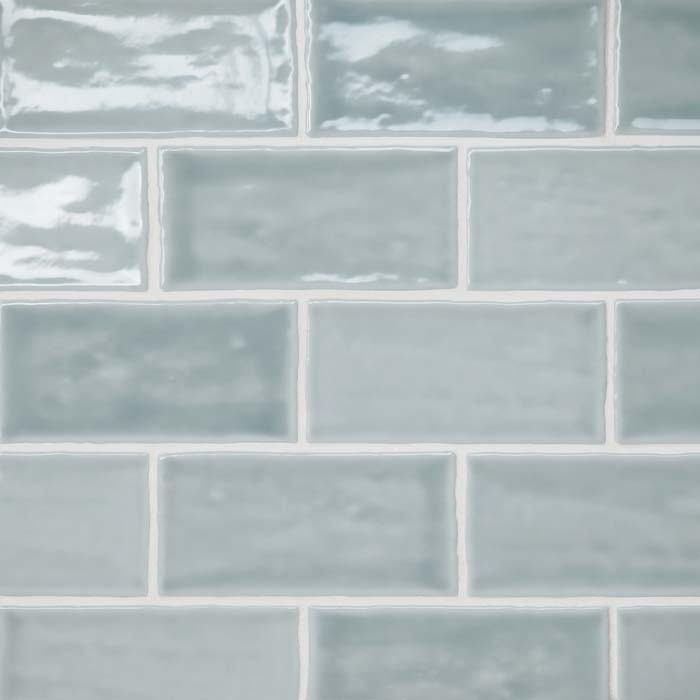
Where is `bottom right tile`? This screenshot has height=700, width=700. bottom right tile is located at coordinates click(x=672, y=648).